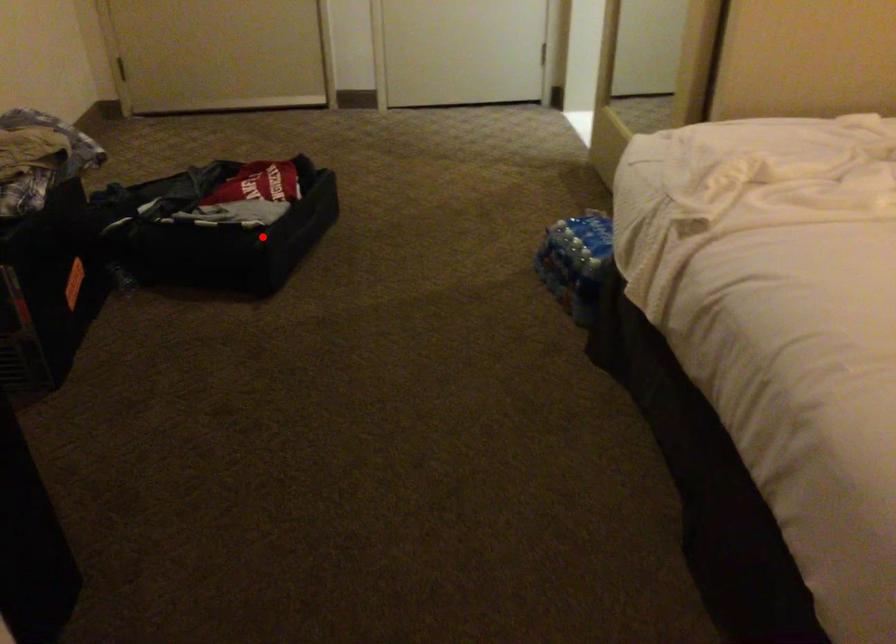
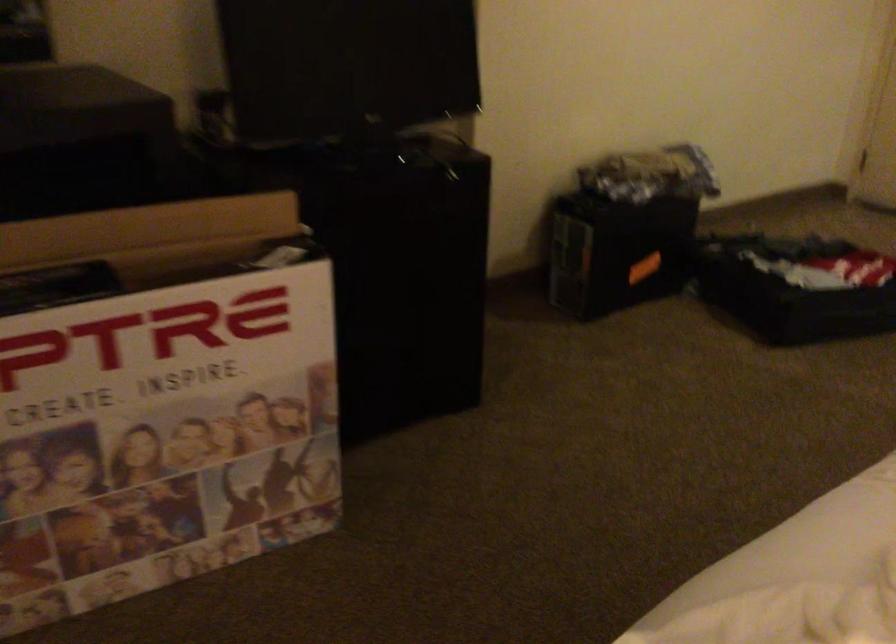
Locate, in the second image, the point that corresponds to the highlighted location in the first image.

(794, 287)